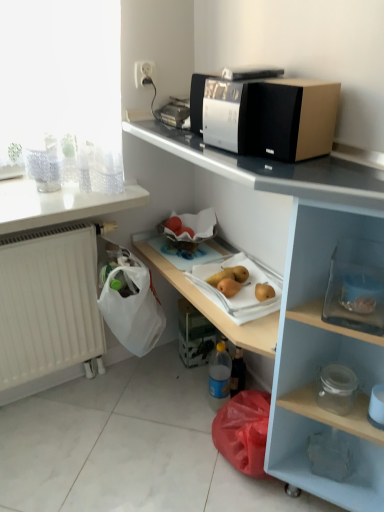
The image size is (384, 512). Find the location of `free space between white glossy countertop at upper center, which is the first countertop from right to left, and white matte radiator at lower left`. free space between white glossy countertop at upper center, which is the first countertop from right to left, and white matte radiator at lower left is located at coordinates (126, 444).